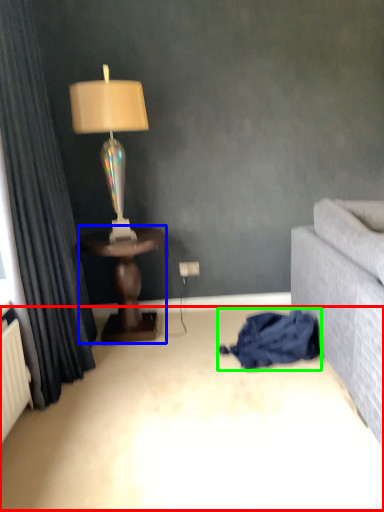
Question: Based on their relative distances, which object is nearer to plain (highlighted by a red box)? Choose from table (highlighted by a blue box) and blanket (highlighted by a green box).

Choices:
 (A) table
 (B) blanket

Answer: (B)